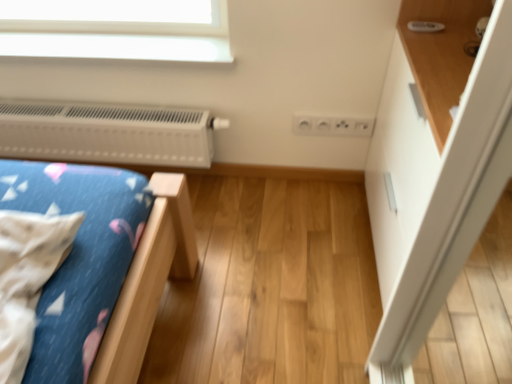
Question: Does white plastic heater at upper left lie behind wooden shelf at upper right?

Choices:
 (A) yes
 (B) no

Answer: (A)

Question: Is white plastic heater at upper left far away from wooden shelf at upper right?

Choices:
 (A) no
 (B) yes

Answer: (A)

Question: Can you confirm if white plastic heater at upper left is bigger than wooden shelf at upper right?

Choices:
 (A) yes
 (B) no

Answer: (B)

Question: Would you say white plastic heater at upper left contains wooden shelf at upper right?

Choices:
 (A) no
 (B) yes

Answer: (A)

Question: Is white plastic heater at upper left shorter than wooden shelf at upper right?

Choices:
 (A) yes
 (B) no

Answer: (A)

Question: Is point (418, 3) positioned closer to the camera than point (433, 150)?

Choices:
 (A) farther
 (B) closer

Answer: (A)

Question: From a real-world perspective, is wooden shelf at upper right positioned above or below white glossy dresser at upper right?

Choices:
 (A) above
 (B) below

Answer: (A)

Question: Considering their positions, is wooden shelf at upper right located in front of or behind white glossy dresser at upper right?

Choices:
 (A) behind
 (B) front

Answer: (B)

Question: In terms of size, does wooden shelf at upper right appear bigger or smaller than white glossy dresser at upper right?

Choices:
 (A) small
 (B) big

Answer: (A)

Question: From a real-world perspective, is white glossy dresser at upper right physically located above or below white plastic heater at upper left?

Choices:
 (A) below
 (B) above

Answer: (B)

Question: Considering their positions, is white glossy dresser at upper right located in front of or behind white plastic heater at upper left?

Choices:
 (A) front
 (B) behind

Answer: (A)

Question: Considering the positions of white glossy dresser at upper right and white plastic heater at upper left in the image, is white glossy dresser at upper right bigger or smaller than white plastic heater at upper left?

Choices:
 (A) big
 (B) small

Answer: (A)

Question: From the image's perspective, is white glossy dresser at upper right above or below white plastic heater at upper left?

Choices:
 (A) above
 (B) below

Answer: (B)

Question: In terms of width, does white plastic heater at upper left look wider or thinner when compared to white glossy dresser at upper right?

Choices:
 (A) wide
 (B) thin

Answer: (B)

Question: In terms of height, does white plastic heater at upper left look taller or shorter compared to white glossy dresser at upper right?

Choices:
 (A) tall
 (B) short

Answer: (B)